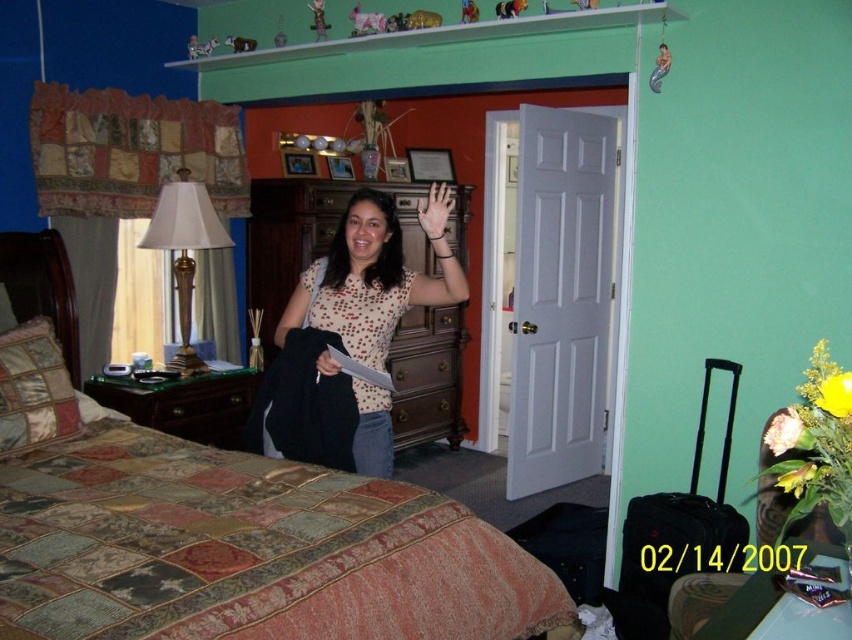
What are the coordinates of the gold metallic lampshade at left?

The gold metallic lampshade at left is located at point (x=183, y=250).